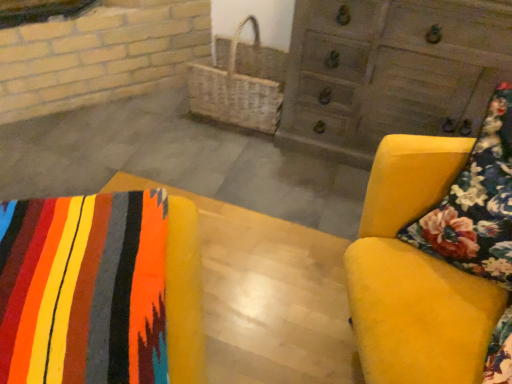
Question: In terms of width, does textured wool blanket at lower left, the 1th furniture viewed from the left, look wider or thinner when compared to wooden chest of drawers at upper right?

Choices:
 (A) wide
 (B) thin

Answer: (A)

Question: Considering their positions, is textured wool blanket at lower left, the 1th furniture viewed from the left, located in front of or behind wooden chest of drawers at upper right?

Choices:
 (A) behind
 (B) front

Answer: (B)

Question: Estimate the real-world distances between objects in this image. Which object is farther from the woven wicker basket at center?

Choices:
 (A) textured wool blanket at lower left, the 2th furniture from the right
 (B) floral fabric cushion at right
 (C) wooden chest of drawers at upper right
 (D) velvet yellow armchair at right, placed as the 1th furniture when sorted from right to left

Answer: (A)

Question: Which is nearer to the wooden chest of drawers at upper right?

Choices:
 (A) velvet yellow armchair at right, placed as the 2th furniture when sorted from left to right
 (B) floral fabric cushion at right
 (C) textured wool blanket at lower left, the 2th furniture from the right
 (D) woven wicker basket at center

Answer: (D)